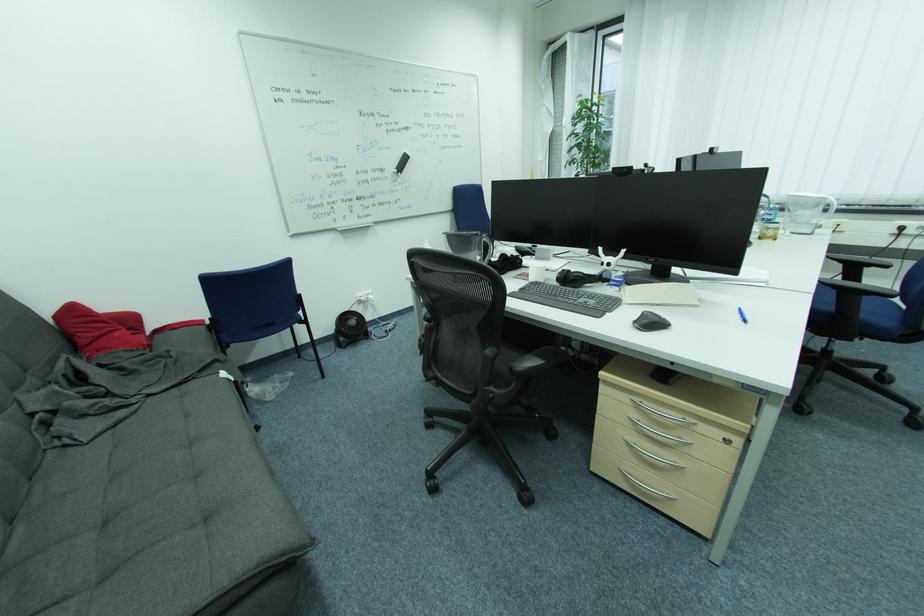
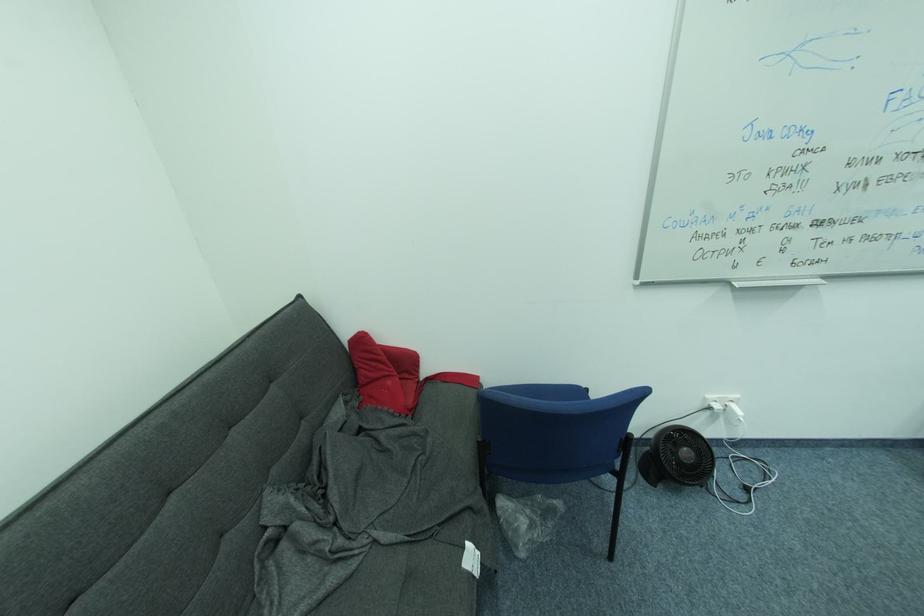
In the second image, find the point that corresponds to the point at 345,350 in the first image.

(648, 479)